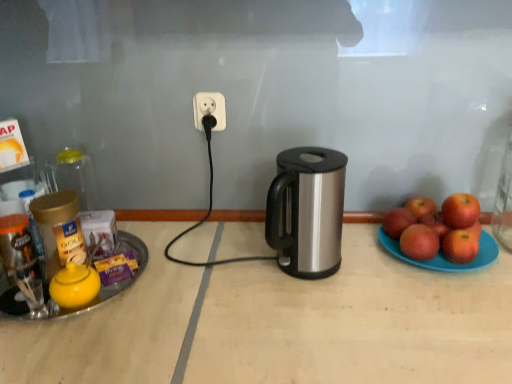
The image size is (512, 384). Find the location of `free spot to the right of silver metallic kettle at center`. free spot to the right of silver metallic kettle at center is located at coordinates (379, 270).